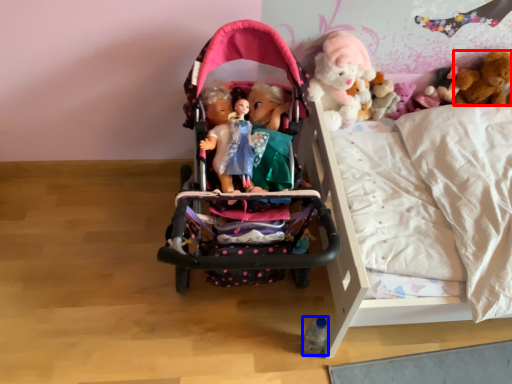
Question: Which point is further to the camera, toy (highlighted by a red box) or toy (highlighted by a blue box)?

Choices:
 (A) toy
 (B) toy

Answer: (A)